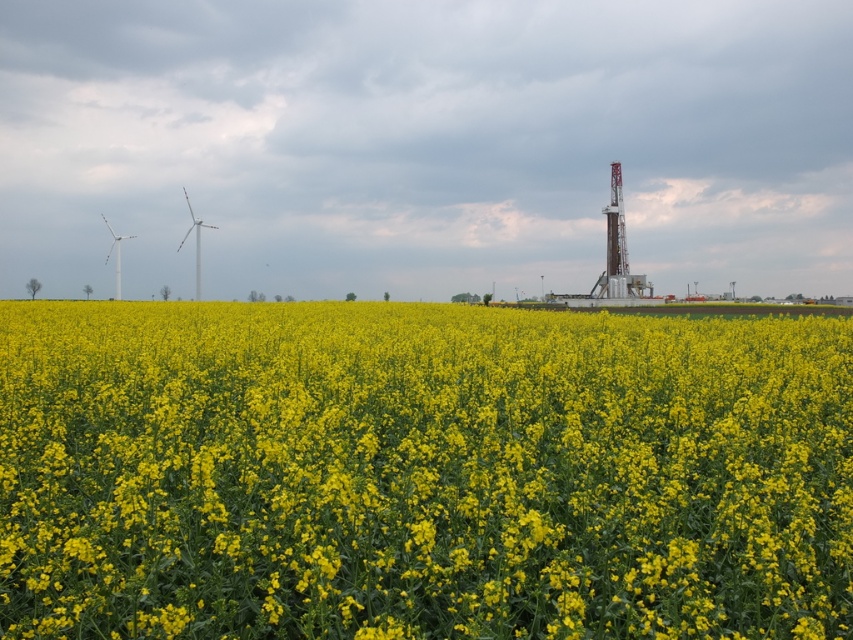
Between point (184, 234) and point (115, 260), which one is positioned behind?

The point (115, 260) is more distant.

Does white composite windmill at left appear over white metallic windmill at left?

Yes.

Image resolution: width=853 pixels, height=640 pixels. What do you see at coordinates (195, 243) in the screenshot?
I see `white composite windmill at left` at bounding box center [195, 243].

I want to click on white composite windmill at left, so click(x=195, y=243).

Does yellow matte flower at center appear over white composite windmill at left?

Incorrect, yellow matte flower at center is not positioned above white composite windmill at left.

Does point (723, 499) come behind point (206, 225)?

No, it is not.

Does point (357, 500) come in front of point (196, 298)?

Yes, it is in front of point (196, 298).

Locate an element on the screen. The image size is (853, 640). yellow matte flower at center is located at coordinates (421, 472).

Can you confirm if yellow matte flower at center is positioned above white metallic windmill at left?

No, yellow matte flower at center is not above white metallic windmill at left.

Is point (273, 397) positioned behind point (105, 262)?

No, it is not.

I want to click on yellow matte flower at center, so click(421, 472).

This screenshot has width=853, height=640. I want to click on yellow matte flower at center, so click(421, 472).